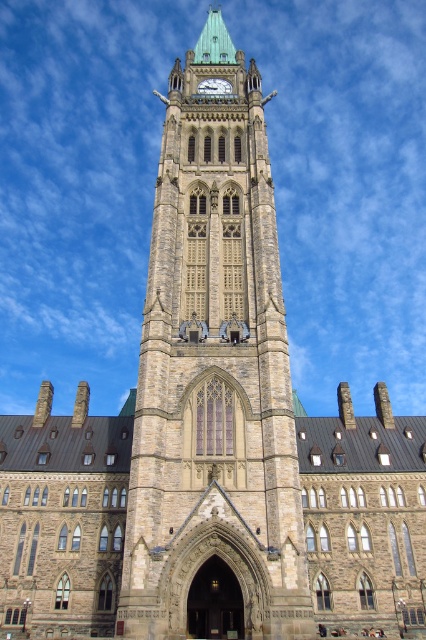
Looking at this image, which is below, brown stone clock tower at center or gold metallic clock at center?

gold metallic clock at center

Is point (192, 586) positioned after point (221, 77)?

No, it is not.

Measure the distance between point (219, 230) and camera.

Point (219, 230) and camera are 56.41 meters apart from each other.

Where is `brown stone clock tower at center`? brown stone clock tower at center is located at coordinates pyautogui.click(x=213, y=380).